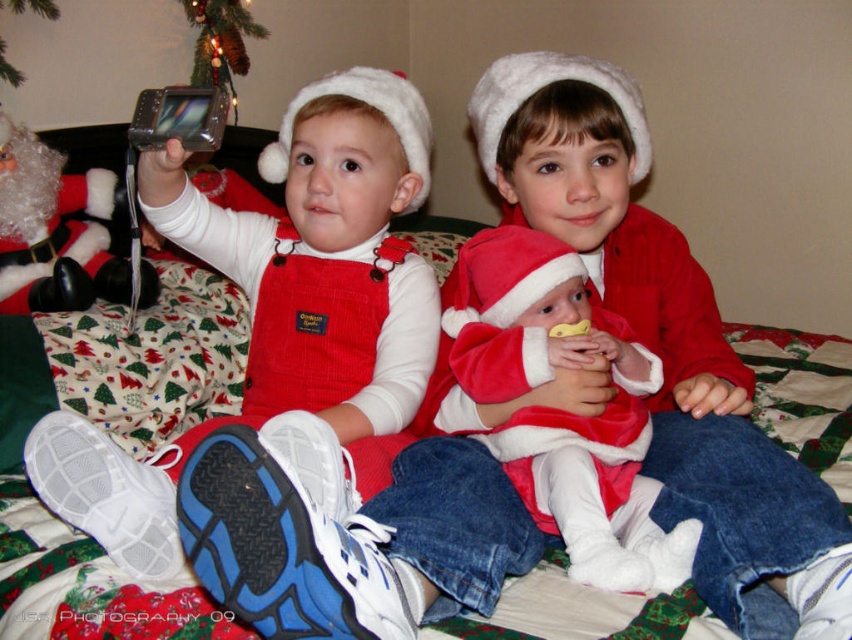
Based on the scene description, which child is wearing the corduroy red overalls at left and is significantly taller than the other child in matte red overalls at lower left?

The child wearing the corduroy red overalls at left is taller than the child in matte red overalls at lower left.

You are a photographer trying to capture a photo of the two Santas in the scene. The velvet red santa suit at center and the fuzzy white santa at left are both in the frame. Based on their positions, which Santa is standing in front of the other?

The velvet red santa suit at center is positioned under the fuzzy white santa at left, meaning the fuzzy white santa at left is standing in front of the velvet red santa suit at center.

You are standing in front of the festive holiday scene with the three children. You want to take a photo of the velvet red santa suit at center without including the other children. Since you are holding a camera with a standard lens that has a 50mm focal length, can you determine if you can achieve this by moving closer or farther away?

The velvet red santa suit at center is 30.03 inches away from the camera. With a standard lens of 50mm, you can adjust your distance to frame the suit without the other children, but since the current distance is already quite close, moving slightly farther back might help include more background or moving closer could zoom in, but ensure the other children are out of frame.